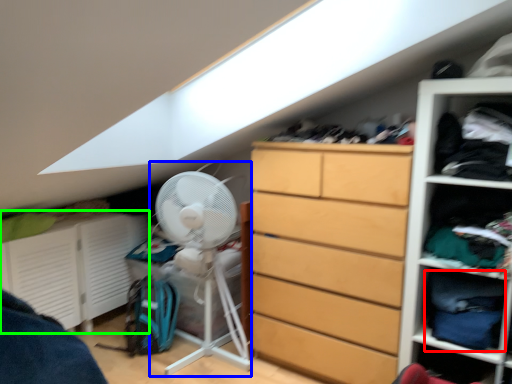
Question: Which object is the closest to the clothing (highlighted by a red box)? Choose among these: fan (highlighted by a blue box) or cabinet (highlighted by a green box).

Choices:
 (A) fan
 (B) cabinet

Answer: (A)